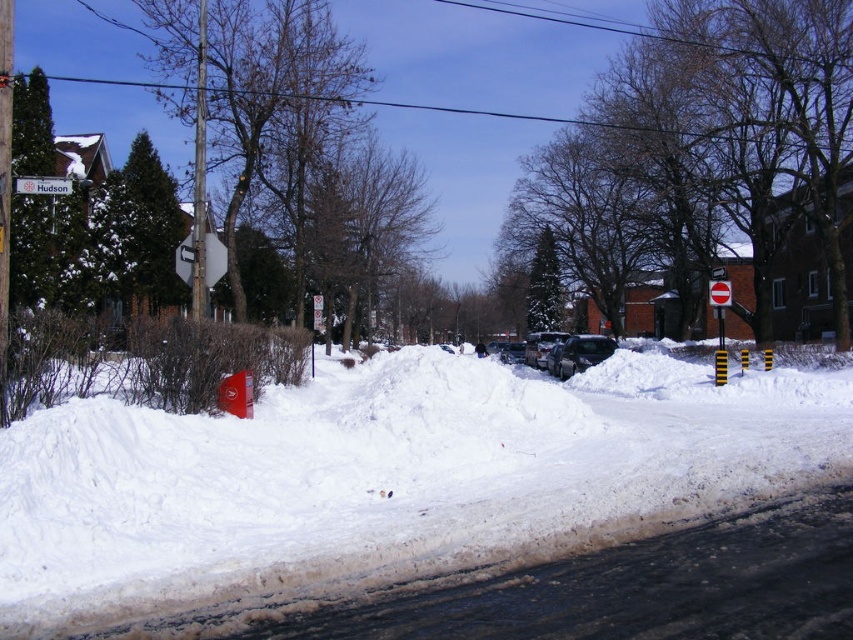
Between sleek black car at center and shiny silver sedan at center, which one has more height?

shiny silver sedan at center is taller.

Does sleek black car at center have a greater width compared to shiny silver sedan at center?

Indeed, sleek black car at center has a greater width compared to shiny silver sedan at center.

Who is more distant from viewer, (596,364) or (540,340)?

The point (540,340) is behind.

What are the coordinates of `sleek black car at center` in the screenshot? It's located at click(x=582, y=353).

Does white fluffy snow at center appear under sleek black car at center?

Yes.

Between white fluffy snow at center and sleek black car at center, which one has less height?

With less height is white fluffy snow at center.

Is point (15, 449) less distant than point (560, 372)?

Yes, point (15, 449) is in front of point (560, 372).

The width and height of the screenshot is (853, 640). I want to click on white fluffy snow at center, so click(x=383, y=477).

Measure the distance between point (x=181, y=609) and camera.

They are 18.37 feet apart.

Who is more forward, (x=314, y=381) or (x=49, y=188)?

Point (x=49, y=188)

Is point (364, 499) positioned after point (65, 180)?

No, (364, 499) is in front of (65, 180).

Image resolution: width=853 pixels, height=640 pixels. I want to click on white fluffy snow at center, so click(x=383, y=477).